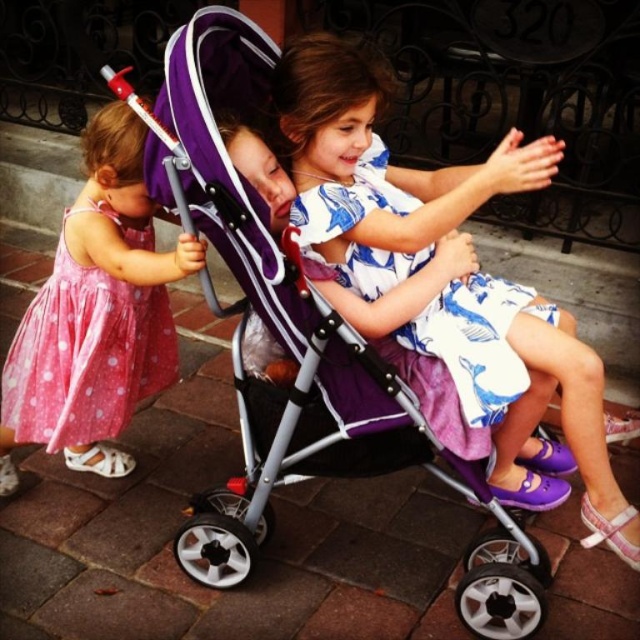
Question: From the image, what is the correct spatial relationship of white floral dress at center in relation to pink polka dot dress at left?

Choices:
 (A) right
 (B) left

Answer: (A)

Question: Which of the following is the closest to the observer?

Choices:
 (A) pink polka dot dress at left
 (B) white printed fabric dress at center

Answer: (B)

Question: Does purple fabric stroller at center have a greater width compared to white floral dress at center?

Choices:
 (A) no
 (B) yes

Answer: (B)

Question: Among these objects, which one is nearest to the camera?

Choices:
 (A) purple fabric stroller at center
 (B) pink polka dot dress at left
 (C) white printed fabric dress at center

Answer: (A)

Question: Does purple fabric stroller at center appear on the left side of white printed fabric dress at center?

Choices:
 (A) yes
 (B) no

Answer: (A)

Question: Which object is farther from the camera taking this photo?

Choices:
 (A) white printed fabric dress at center
 (B) purple fabric stroller at center
 (C) pink polka dot dress at left
 (D) white floral dress at center

Answer: (C)